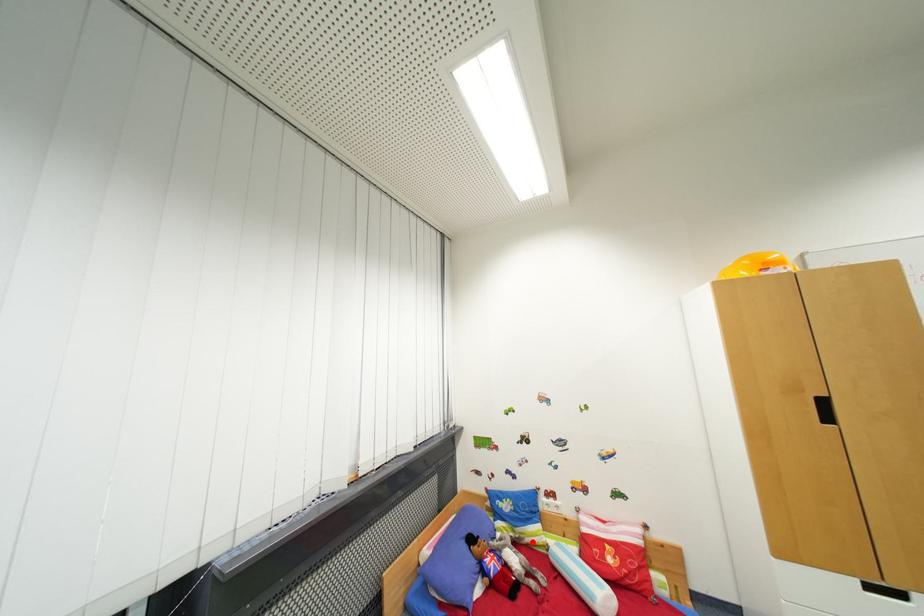
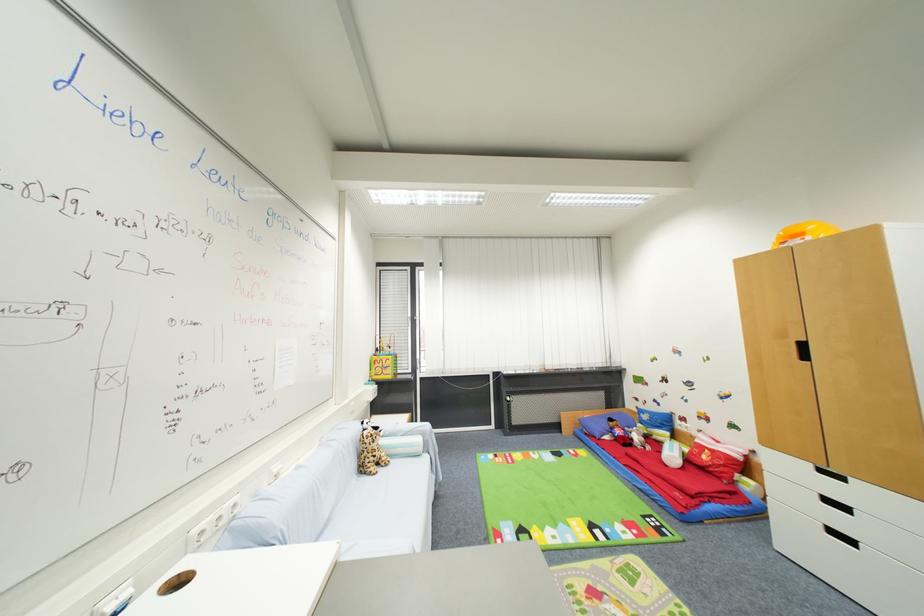
Locate, in the second image, the point that corresponds to the highlighted location in the first image.

(660, 439)